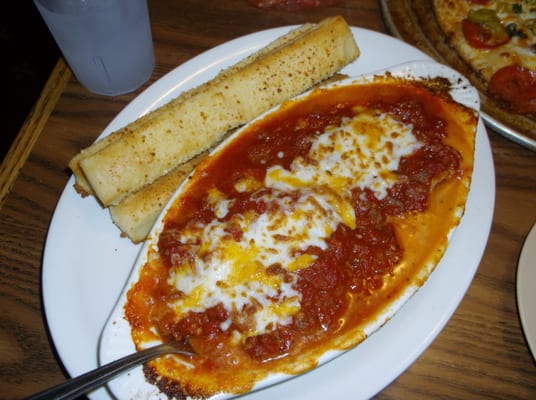
Identify the location of utensil. The image size is (536, 400). (126, 355).